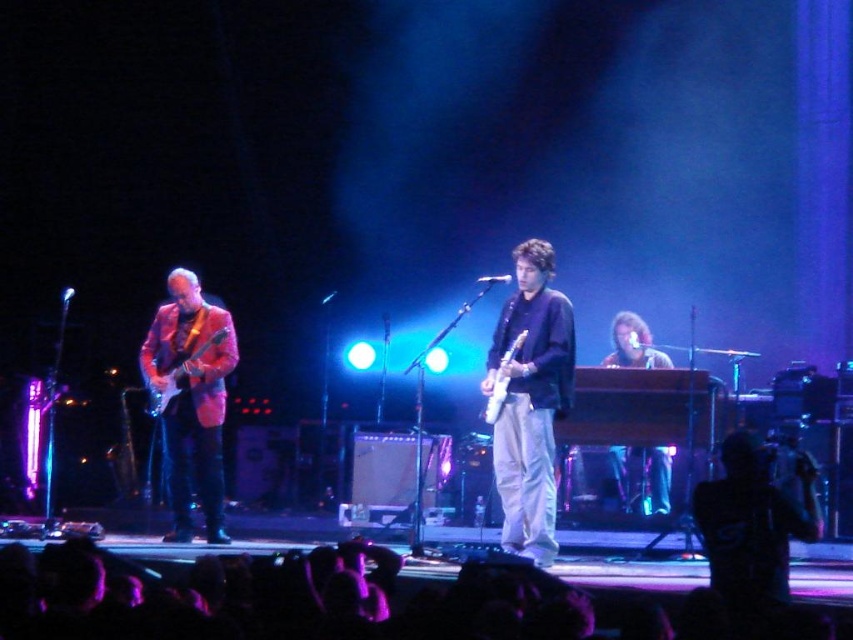
Does shiny pink jacket at left appear on the left side of shiny metallic guitar at left?

No, shiny pink jacket at left is not to the left of shiny metallic guitar at left.

Can you confirm if shiny pink jacket at left is bigger than shiny metallic guitar at left?

Yes, shiny pink jacket at left is bigger than shiny metallic guitar at left.

What are the coordinates of `shiny pink jacket at left` in the screenshot? It's located at (190, 397).

Find the location of `shiny pink jacket at left`. shiny pink jacket at left is located at coordinates (190, 397).

Where is `matte black guitar at center`? The image size is (853, 640). matte black guitar at center is located at coordinates pos(531,401).

What do you see at coordinates (531, 401) in the screenshot? I see `matte black guitar at center` at bounding box center [531, 401].

This screenshot has width=853, height=640. Describe the element at coordinates (531, 401) in the screenshot. I see `matte black guitar at center` at that location.

Image resolution: width=853 pixels, height=640 pixels. I want to click on matte black guitar at center, so click(x=531, y=401).

Is shiny pink jacket at left above wooden keyboard at center?

Correct, shiny pink jacket at left is located above wooden keyboard at center.

Looking at this image, can you confirm if shiny pink jacket at left is shorter than wooden keyboard at center?

Incorrect, shiny pink jacket at left's height does not fall short of wooden keyboard at center's.

Is point (170, 289) farther from viewer compared to point (611, 355)?

That is False.

Image resolution: width=853 pixels, height=640 pixels. Find the location of `shiny pink jacket at left`. shiny pink jacket at left is located at coordinates (190, 397).